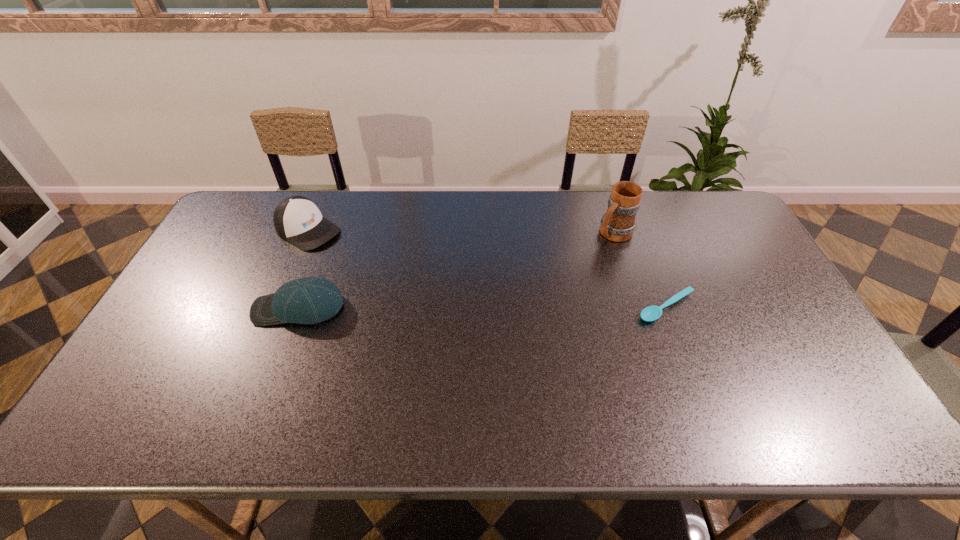
Image resolution: width=960 pixels, height=540 pixels. Find the location of `the third tallest object`. the third tallest object is located at coordinates (310, 300).

This screenshot has height=540, width=960. What are the coordinates of `the shortest object` in the screenshot? It's located at (651, 313).

At what (x,y) coordinates should I click in order to perform the action: click on mug. Please return your answer as a coordinate pair (x, y). Image resolution: width=960 pixels, height=540 pixels. Looking at the image, I should click on (618, 224).

Where is `cap`? The height and width of the screenshot is (540, 960). cap is located at coordinates (297, 219).

Identify the location of free location located 0.130m on the front of the baseball cap. (276, 369).

At what (x,y) coordinates should I click in order to perform the action: click on free point located 0.110m on the left of the spoon. Please return your answer as a coordinate pair (x, y). The image size is (960, 540). Looking at the image, I should click on (595, 307).

At what (x,y) coordinates should I click in order to perform the action: click on free spot located 0.200m on the side of the mug with the handle. Please return your answer as a coordinate pair (x, y). Looking at the image, I should click on (564, 274).

Where is `free location located 0.170m on the side of the mug with the handle`? The width and height of the screenshot is (960, 540). free location located 0.170m on the side of the mug with the handle is located at coordinates (570, 269).

This screenshot has width=960, height=540. Find the location of `free spot located 0.320m on the side of the mug with the handle`. free spot located 0.320m on the side of the mug with the handle is located at coordinates (538, 295).

This screenshot has height=540, width=960. Identify the location of free location located on the front panel of the cap. (406, 288).